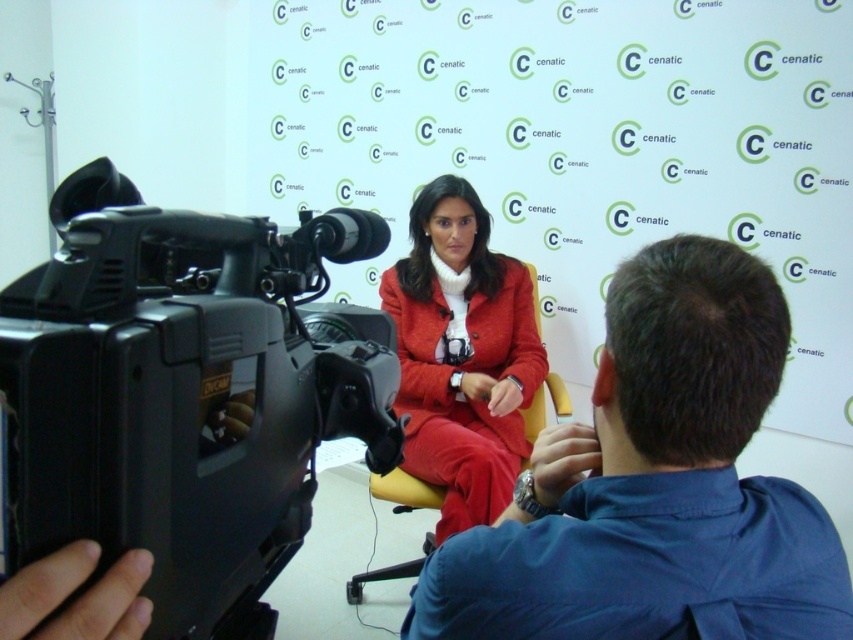
Can you confirm if black plastic video camera at left is shorter than matte red suit at center?

Yes.

Is point (143, 291) positioned before point (467, 196)?

Yes, it is.

At what (x,y) coordinates should I click in order to perform the action: click on black plastic video camera at left. Please return your answer as a coordinate pair (x, y). The image size is (853, 640). Looking at the image, I should click on (186, 394).

What do you see at coordinates (654, 484) in the screenshot? Image resolution: width=853 pixels, height=640 pixels. I see `blue cotton shirt at center` at bounding box center [654, 484].

Is blue cotton shirt at center closer to the viewer compared to matte red suit at center?

Yes, it is.

Is point (648, 328) closer to viewer compared to point (476, 488)?

Yes, it is.

The width and height of the screenshot is (853, 640). Identify the location of blue cotton shirt at center. pos(654,484).

Between black plastic video camera at left and blue cotton shirt at center, which one has more height?

Standing taller between the two is black plastic video camera at left.

Does point (12, 550) come in front of point (567, 579)?

Yes, point (12, 550) is in front of point (567, 579).

Does point (112, 228) come behind point (556, 545)?

That is False.

The width and height of the screenshot is (853, 640). I want to click on black plastic video camera at left, so click(186, 394).